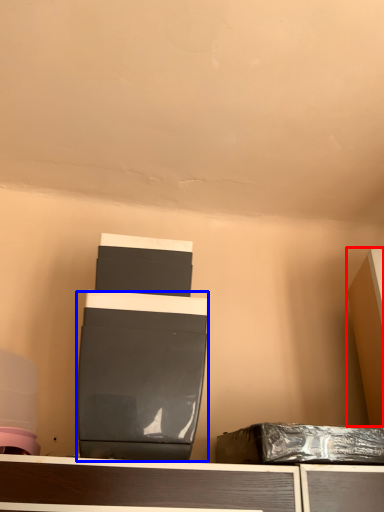
Question: Which object appears farthest to the camera in this image, furniture (highlighted by a red box) or wide (highlighted by a blue box)?

Choices:
 (A) furniture
 (B) wide

Answer: (A)